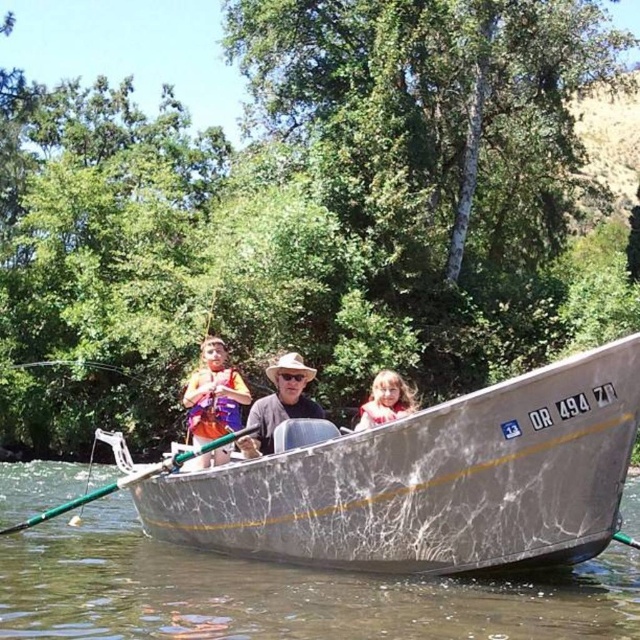
Question: Considering the relative positions of silver metallic boat at center and green metallic paddle at center in the image provided, where is silver metallic boat at center located with respect to green metallic paddle at center?

Choices:
 (A) above
 (B) below

Answer: (A)

Question: Can you confirm if matte gray hat at center is smaller than light brown hair at center?

Choices:
 (A) yes
 (B) no

Answer: (A)

Question: Estimate the real-world distances between objects in this image. Which object is farther from the green metallic paddle at center?

Choices:
 (A) matte gray hat at center
 (B) light brown hair at center
 (C) orange life vest at center
 (D) silver metallic boat at center

Answer: (D)

Question: Which point appears farthest from the camera in this image?

Choices:
 (A) (228, 442)
 (B) (582, 362)
 (C) (307, 368)
 (D) (362, 428)

Answer: (C)

Question: Can you confirm if orange life vest at center is positioned to the left of light brown hair at center?

Choices:
 (A) yes
 (B) no

Answer: (A)

Question: Among these objects, which one is farthest from the camera?

Choices:
 (A) matte gray hat at center
 (B) orange life vest at center

Answer: (B)